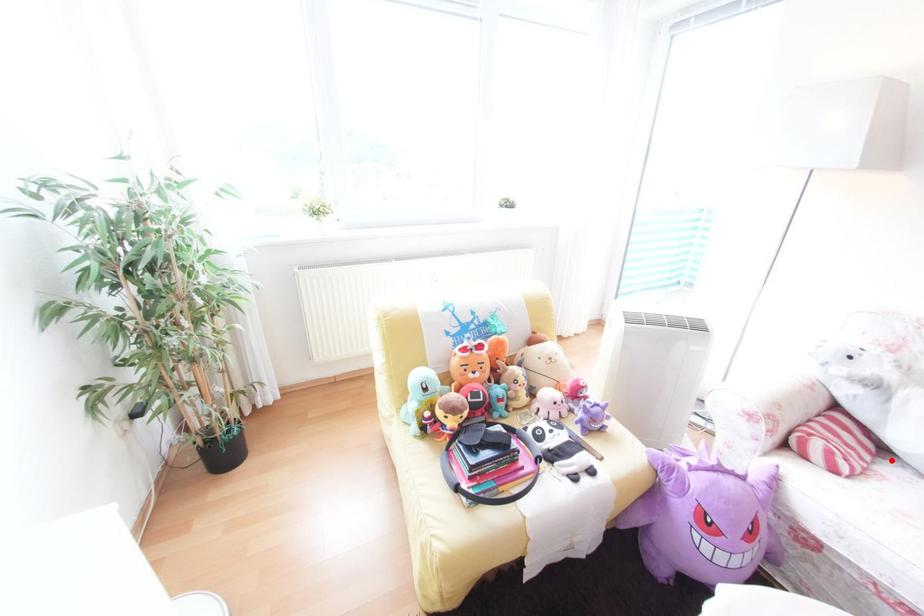
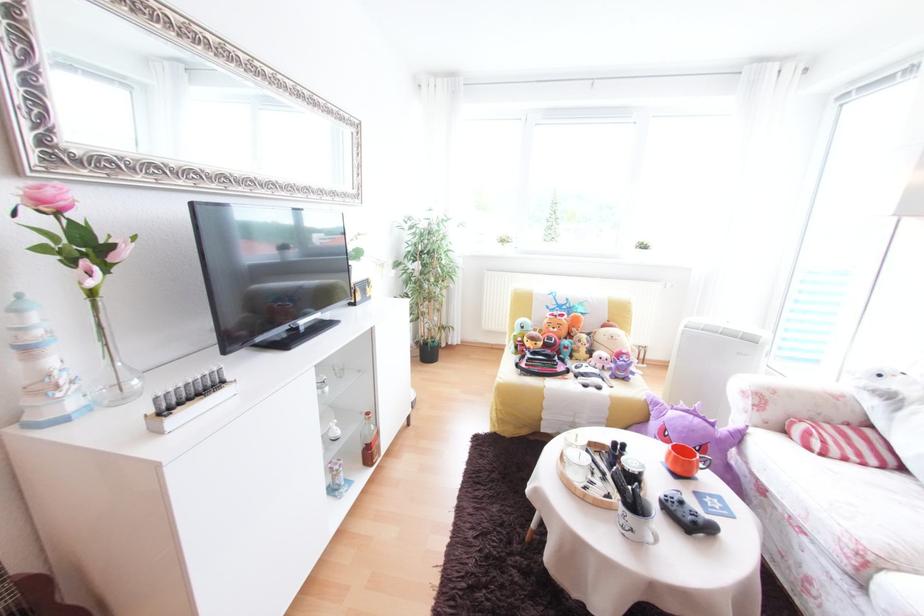
In the second image, find the point that corresponds to the highlighted location in the first image.

(907, 472)